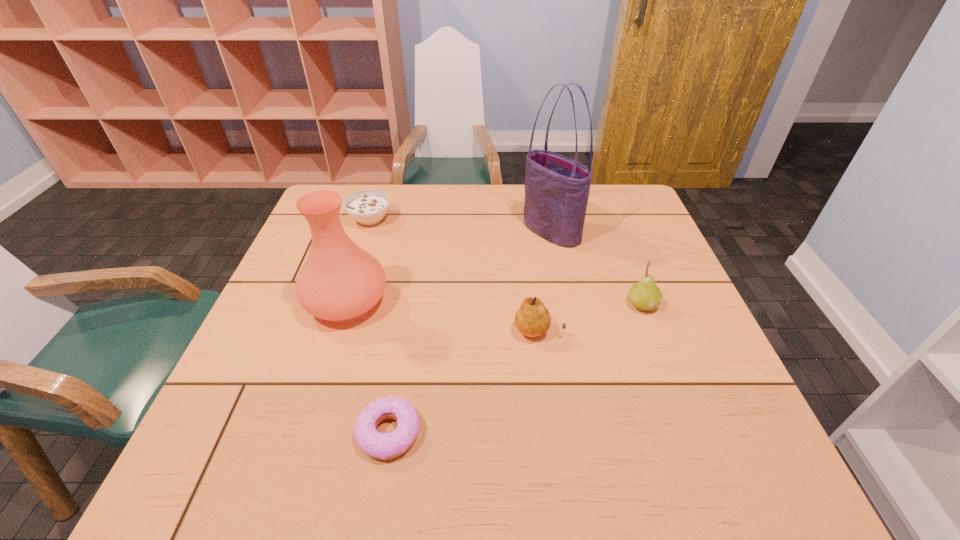
This screenshot has width=960, height=540. Find the location of `free spot located on the front of the vase`. free spot located on the front of the vase is located at coordinates (313, 408).

At what (x,y) coordinates should I click in order to perform the action: click on free space located 0.050m on the back of the farther pear. Please return your answer as a coordinate pair (x, y). Looking at the image, I should click on (633, 280).

This screenshot has height=540, width=960. In order to click on free space located on the front of the third shortest object in this screenshot , I will do `click(552, 433)`.

Where is `vacant region located 0.240m on the right of the second shortest object`? The width and height of the screenshot is (960, 540). vacant region located 0.240m on the right of the second shortest object is located at coordinates (471, 219).

The image size is (960, 540). In order to click on vacant space situated 0.310m on the right of the shortest object in this screenshot , I will do `click(590, 433)`.

Identify the location of tote bag present at the far edge. The height and width of the screenshot is (540, 960). pyautogui.click(x=557, y=188).

The width and height of the screenshot is (960, 540). What are the coordinates of `soup bowl at the far edge` in the screenshot? It's located at (368, 207).

You are a GUI agent. You are given a task and a screenshot of the screen. Output one action in this format:
    pyautogui.click(x=<x>, y=<y>)
    Task: Click on the object located in the near edge section of the desktop
    This screenshot has height=540, width=960.
    Given the screenshot: What is the action you would take?
    pyautogui.click(x=375, y=444)

Locate an element on the screen. The width and height of the screenshot is (960, 540). vase present at the left edge is located at coordinates (340, 282).

The height and width of the screenshot is (540, 960). What are the coordinates of `soup bowl at the left edge` in the screenshot? It's located at (368, 207).